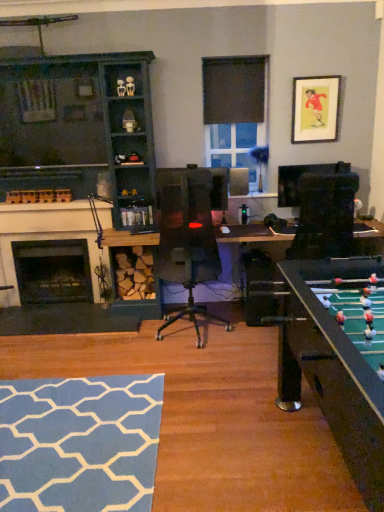
In the scene shown: Measure the distance between point (73, 258) and camera.

13.52 feet.

The width and height of the screenshot is (384, 512). In order to click on clear glass window at center in this screenshot , I will do `click(235, 147)`.

Where is `dark wood cabinet at left`? This screenshot has height=512, width=384. dark wood cabinet at left is located at coordinates (81, 129).

Identify the location of blue fabric rug at lower left. (79, 443).

In the image, is white painted wood fireplace at left, the 1th fireplace in the front-to-back sequence, on the left side or the right side of black matte fireplace at left, the 1th fireplace from the back?

From the image, it's evident that white painted wood fireplace at left, the 1th fireplace in the front-to-back sequence, is to the right of black matte fireplace at left, the 1th fireplace from the back.

Can you tell me how much white painted wood fireplace at left, placed as the second fireplace when sorted from back to front, and black matte fireplace at left, the 2th fireplace positioned from the front, differ in facing direction?

They differ by 0.00504 degrees in their facing directions.

Which object is thinner, white painted wood fireplace at left, placed as the second fireplace when sorted from back to front, or black matte fireplace at left, the 2th fireplace positioned from the front?

white painted wood fireplace at left, placed as the second fireplace when sorted from back to front.

Does point (87, 93) lie behind point (63, 395)?

Yes, it is.

From a real-world perspective, which object rests below the other?

blue fabric rug at lower left.

Which object is wider, dark wood cabinet at left or blue fabric rug at lower left?

blue fabric rug at lower left.

Is dark wood cabinet at left inside the boundaries of blue fabric rug at lower left, or outside?

dark wood cabinet at left is not inside blue fabric rug at lower left, it's outside.

Is blue fabric rug at lower left facing towards clear glass window at center?

No, blue fabric rug at lower left is not oriented towards clear glass window at center.

Is blue fabric rug at lower left positioned far away from clear glass window at center?

Absolutely, blue fabric rug at lower left is distant from clear glass window at center.

Considering the points (6, 484) and (30, 265), which point is behind, point (6, 484) or point (30, 265)?

The point (30, 265) is farther.

From a real-world perspective, between blue fabric rug at lower left and black matte fireplace at left, the 2th fireplace positioned from the front, who is vertically higher?

black matte fireplace at left, the 2th fireplace positioned from the front, is physically above.

From the picture: Between blue fabric rug at lower left and black matte fireplace at left, the 1th fireplace from the back, which one has smaller size?

With smaller size is blue fabric rug at lower left.

Could you tell me if blue fabric rug at lower left is facing black matte fireplace at left, the 1th fireplace from the back?

No, blue fabric rug at lower left does not turn towards black matte fireplace at left, the 1th fireplace from the back.

From the image's perspective, is black matte fireplace at left, the 2th fireplace positioned from the front, located beneath dark wood cabinet at left?

Correct, black matte fireplace at left, the 2th fireplace positioned from the front, appears lower than dark wood cabinet at left in the image.

Is black matte fireplace at left, the 2th fireplace positioned from the front, in front of or behind dark wood cabinet at left in the image?

black matte fireplace at left, the 2th fireplace positioned from the front, is positioned farther from the viewer than dark wood cabinet at left.

Locate an element on the screen. The image size is (384, 512). fireplace that is the 2nd object located behind the dark wood cabinet at left is located at coordinates (53, 271).

From the picture: Considering the relative sizes of clear glass window at center and dark wood cabinet at left in the image provided, is clear glass window at center taller than dark wood cabinet at left?

In fact, clear glass window at center may be shorter than dark wood cabinet at left.

From a real-world perspective, is clear glass window at center below dark wood cabinet at left?

Incorrect, from a real-world perspective, clear glass window at center is higher than dark wood cabinet at left.

Are clear glass window at center and dark wood cabinet at left beside each other?

clear glass window at center and dark wood cabinet at left are clearly separated.

From the image's perspective, who appears lower, clear glass window at center or dark wood cabinet at left?

dark wood cabinet at left appears lower in the image.

Which is more distant, (21,418) or (317,110)?

The point (317,110) is farther.

From the image's perspective, is blue fabric rug at lower left located above matte paper picture frame at upper right?

Actually, blue fabric rug at lower left appears below matte paper picture frame at upper right in the image.

Based on the photo, is blue fabric rug at lower left closer to camera compared to matte paper picture frame at upper right?

Yes.

Considering the relative positions of blue fabric rug at lower left and matte paper picture frame at upper right in the image provided, is blue fabric rug at lower left to the left of matte paper picture frame at upper right from the viewer's perspective?

Indeed, blue fabric rug at lower left is positioned on the left side of matte paper picture frame at upper right.

Find the location of a particular element. Image resolution: width=384 pixels, height=512 pixels. fireplace located below the white painted wood fireplace at left, placed as the second fireplace when sorted from back to front (from the image's perspective) is located at coordinates pos(53,271).

Locate an element on the screen. The height and width of the screenshot is (512, 384). cabinetry that is on the left side of blue fabric rug at lower left is located at coordinates (81, 129).

Looking at the image, which one is located further to clear glass window at center, blue fabric rug at lower left or black fabric curtain at upper center?

Based on the image, blue fabric rug at lower left appears to be further to clear glass window at center.

Looking at the image, which one is located closer to matte paper picture frame at upper right, blue fabric rug at lower left or white painted wood fireplace at left, the 1th fireplace in the front-to-back sequence?

white painted wood fireplace at left, the 1th fireplace in the front-to-back sequence, lies closer to matte paper picture frame at upper right than the other object.

From the image, which object appears to be nearer to dark wood cabinet at left, black matte fireplace at left, the 2th fireplace positioned from the front, or clear glass window at center?

Based on the image, black matte fireplace at left, the 2th fireplace positioned from the front, appears to be nearer to dark wood cabinet at left.

From the image, which object appears to be farther from clear glass window at center, black fabric curtain at upper center or matte paper picture frame at upper right?

Based on the image, matte paper picture frame at upper right appears to be further to clear glass window at center.

Based on their spatial positions, is black fabric curtain at upper center or black matte fireplace at left, the 1th fireplace from the back, further from dark wood cabinet at left?

black fabric curtain at upper center is further to dark wood cabinet at left.

Estimate the real-world distances between objects in this image. Which object is further from blue fabric rug at lower left, clear glass window at center or white painted wood fireplace at left, the 1th fireplace in the front-to-back sequence?

clear glass window at center lies further to blue fabric rug at lower left than the other object.

Looking at this image, estimate the real-world distances between objects in this image. Which object is further from matte paper picture frame at upper right, clear glass window at center or black matte fireplace at left, the 2th fireplace positioned from the front?

black matte fireplace at left, the 2th fireplace positioned from the front, is positioned further to the anchor matte paper picture frame at upper right.

Which object lies further to the anchor point black fabric curtain at upper center, blue fabric rug at lower left or white painted wood fireplace at left, the 1th fireplace in the front-to-back sequence?

Among the two, blue fabric rug at lower left is located further to black fabric curtain at upper center.

The image size is (384, 512). I want to click on cabinetry between black matte fireplace at left, the 2th fireplace positioned from the front, and clear glass window at center from left to right, so click(81, 129).

This screenshot has height=512, width=384. I want to click on flat between black matte fireplace at left, the 1th fireplace from the back, and matte paper picture frame at upper right from left to right, so click(x=79, y=443).

Find the location of a particular element. The width and height of the screenshot is (384, 512). window screen between black fabric curtain at upper center and blue fabric rug at lower left from top to bottom is located at coordinates (235, 147).

The height and width of the screenshot is (512, 384). I want to click on curtain between black matte fireplace at left, the 2th fireplace positioned from the front, and clear glass window at center from left to right, so click(x=233, y=90).